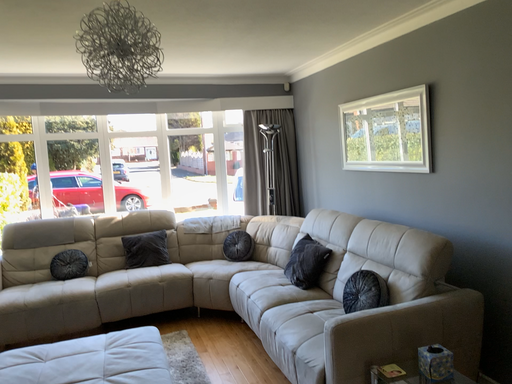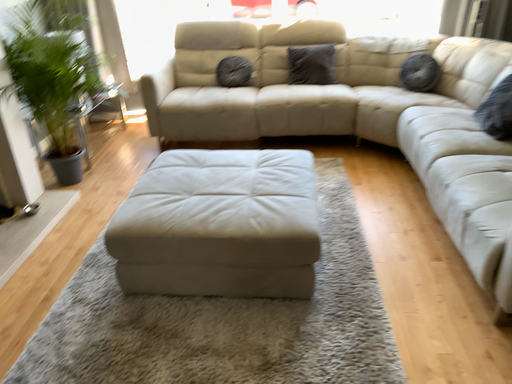
Question: Which way did the camera rotate in the video?

Choices:
 (A) rotated left
 (B) rotated right

Answer: (A)